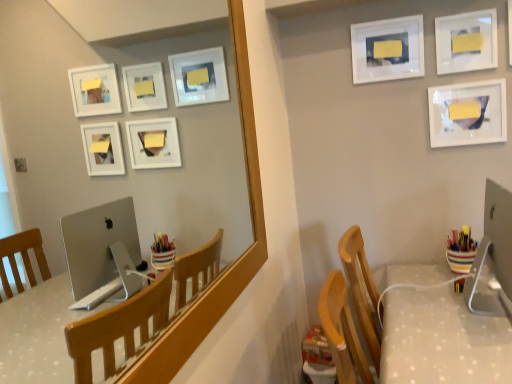
Identify the location of free space to the left of sleek silver monitor at right. The image size is (512, 384). (426, 312).